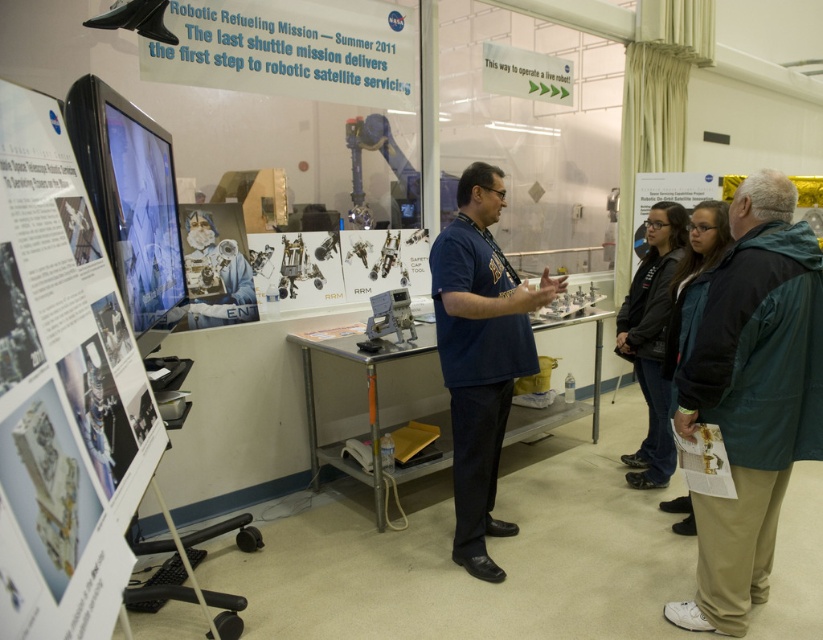
Between blue paper at upper center and green plastic sign at upper center, which one has more height?

blue paper at upper center

Does blue paper at upper center appear under green plastic sign at upper center?

Correct, blue paper at upper center is located below green plastic sign at upper center.

At what (x,y) coordinates should I click in order to perform the action: click on blue paper at upper center. Please return your answer as a coordinate pair (x, y). This screenshot has width=823, height=640. Looking at the image, I should click on (291, 49).

Which is above, green fabric jacket at lower right or dark blue jacket at center?

dark blue jacket at center is above.

Does green fabric jacket at lower right appear over dark blue jacket at center?

No.

Find the location of `green fabric jacket at lower right`. green fabric jacket at lower right is located at coordinates (749, 394).

Can you confirm if blue fabric shirt at center is smaller than black jacket at center?

No.

Is blue fabric shirt at center behind black jacket at center?

No, it is not.

Is point (533, 356) less distant than point (658, 419)?

Yes, point (533, 356) is closer to viewer.

Where is `blue fabric shirt at center`? The image size is (823, 640). blue fabric shirt at center is located at coordinates (480, 355).